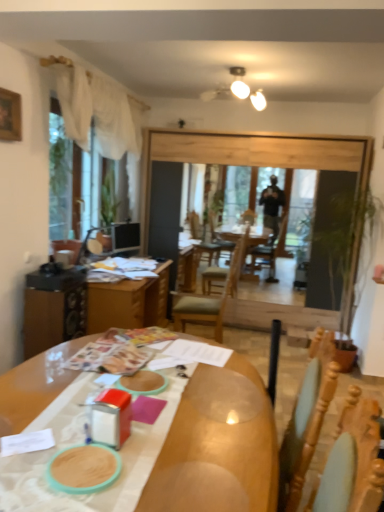
Question: Is matte black monitor at left to the left or to the right of wooden picture frame at upper left in the image?

Choices:
 (A) left
 (B) right

Answer: (B)

Question: Considering the positions of matte black monitor at left and wooden picture frame at upper left in the image, is matte black monitor at left bigger or smaller than wooden picture frame at upper left?

Choices:
 (A) big
 (B) small

Answer: (A)

Question: Considering the real-world distances, which object is closest to the transparent glass window screen at left?

Choices:
 (A) wooden table at center
 (B) wooden chair at center
 (C) wooden picture frame at upper left
 (D) wooden table at center
 (E) matte black monitor at left

Answer: (E)

Question: Based on their relative distances, which object is nearer to the wooden table at center?

Choices:
 (A) wooden picture frame at upper left
 (B) matte black monitor at left
 (C) wooden chair at center
 (D) wooden table at center
 (E) transparent glass window screen at left

Answer: (C)